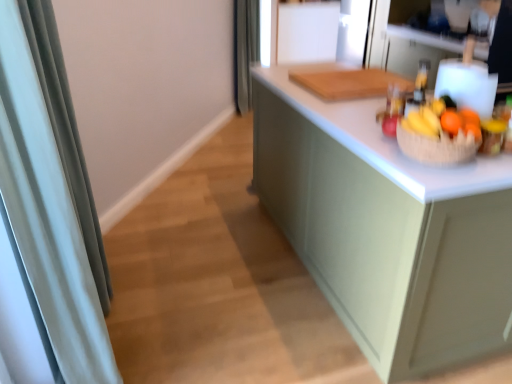
Question: Is matte green cabinet at center wider than translucent glass bottle at upper right?

Choices:
 (A) no
 (B) yes

Answer: (B)

Question: From a real-world perspective, is matte green cabinet at center physically below translucent glass bottle at upper right?

Choices:
 (A) yes
 (B) no

Answer: (A)

Question: Are matte green cabinet at center and translucent glass bottle at upper right located far from each other?

Choices:
 (A) no
 (B) yes

Answer: (A)

Question: Is matte green cabinet at center completely or partially outside of translucent glass bottle at upper right?

Choices:
 (A) yes
 (B) no

Answer: (A)

Question: From the image's perspective, is matte green cabinet at center on top of translucent glass bottle at upper right?

Choices:
 (A) yes
 (B) no

Answer: (B)

Question: From a real-world perspective, is matte green cabinet at center located higher than translucent glass bottle at upper right?

Choices:
 (A) no
 (B) yes

Answer: (A)

Question: Considering the relative sizes of brown woven basket at right and translucent glass bottle at upper right in the image provided, is brown woven basket at right taller than translucent glass bottle at upper right?

Choices:
 (A) yes
 (B) no

Answer: (B)

Question: From the image's perspective, would you say brown woven basket at right is positioned over translucent glass bottle at upper right?

Choices:
 (A) no
 (B) yes

Answer: (A)

Question: From the image's perspective, would you say brown woven basket at right is shown under translucent glass bottle at upper right?

Choices:
 (A) no
 (B) yes

Answer: (B)

Question: Is brown woven basket at right not close to translucent glass bottle at upper right?

Choices:
 (A) yes
 (B) no

Answer: (B)

Question: Does brown woven basket at right lie in front of translucent glass bottle at upper right?

Choices:
 (A) yes
 (B) no

Answer: (A)

Question: Is brown woven basket at right looking in the opposite direction of translucent glass bottle at upper right?

Choices:
 (A) yes
 (B) no

Answer: (B)

Question: Does matte green cabinet at center lie behind brown woven basket at right?

Choices:
 (A) yes
 (B) no

Answer: (B)